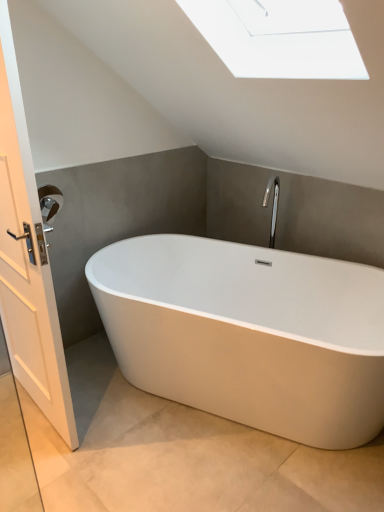
Question: Considering the relative sizes of white glossy bathtub at center and white wooden door at left in the image provided, is white glossy bathtub at center shorter than white wooden door at left?

Choices:
 (A) yes
 (B) no

Answer: (A)

Question: Is white glossy bathtub at center further to camera compared to white wooden door at left?

Choices:
 (A) yes
 (B) no

Answer: (A)

Question: From the image's perspective, would you say white glossy bathtub at center is shown under white wooden door at left?

Choices:
 (A) yes
 (B) no

Answer: (A)

Question: Would you say white wooden door at left is part of white glossy bathtub at center's contents?

Choices:
 (A) no
 (B) yes

Answer: (A)

Question: Can you confirm if white glossy bathtub at center is positioned to the left of white wooden door at left?

Choices:
 (A) no
 (B) yes

Answer: (A)

Question: Considering the positions of white glossy bathtub at center and white wooden door at left in the image, is white glossy bathtub at center wider or thinner than white wooden door at left?

Choices:
 (A) wide
 (B) thin

Answer: (A)

Question: Is white glossy bathtub at center in front of or behind white wooden door at left in the image?

Choices:
 (A) behind
 (B) front

Answer: (A)

Question: From the image's perspective, is white glossy bathtub at center positioned above or below white wooden door at left?

Choices:
 (A) below
 (B) above

Answer: (A)

Question: Which is correct: white glossy bathtub at center is inside white wooden door at left, or outside of it?

Choices:
 (A) outside
 (B) inside

Answer: (A)

Question: Is point (13, 371) closer or farther from the camera than point (342, 315)?

Choices:
 (A) farther
 (B) closer

Answer: (B)

Question: From the image's perspective, relative to white glossy bathtub at center, is white wooden door at left above or below?

Choices:
 (A) above
 (B) below

Answer: (A)

Question: Based on their sizes in the image, would you say white wooden door at left is bigger or smaller than white glossy bathtub at center?

Choices:
 (A) small
 (B) big

Answer: (A)

Question: In terms of height, does white wooden door at left look taller or shorter compared to white glossy bathtub at center?

Choices:
 (A) tall
 (B) short

Answer: (A)

Question: Is brushed metal towel bar at left wider or thinner than white wooden door at left?

Choices:
 (A) thin
 (B) wide

Answer: (B)

Question: Considering the positions of brushed metal towel bar at left and white wooden door at left in the image, is brushed metal towel bar at left taller or shorter than white wooden door at left?

Choices:
 (A) tall
 (B) short

Answer: (B)